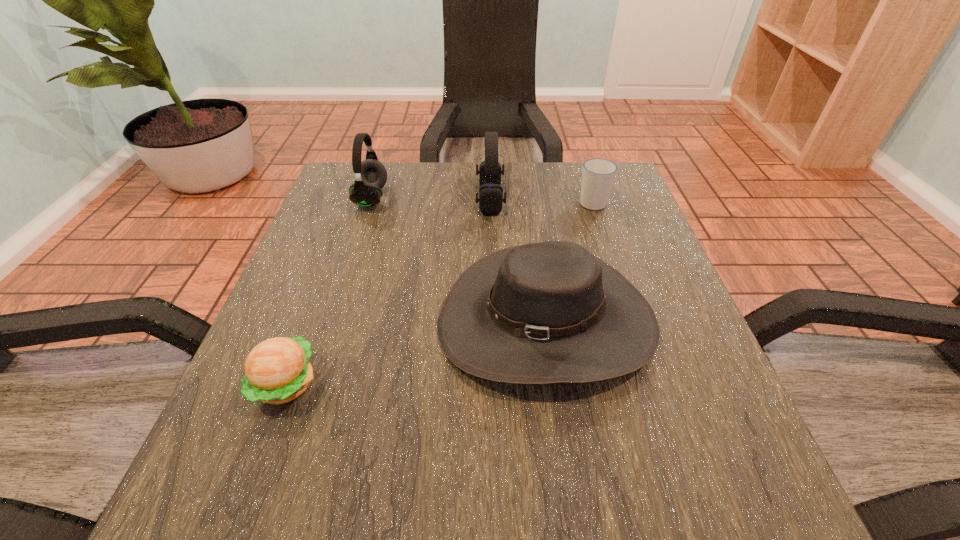
What are the coordinates of `free space located 0.080m with a handle on the side of the cup` in the screenshot? It's located at (584, 176).

Where is `vacant area located 0.150m with a handle on the side of the cup`? vacant area located 0.150m with a handle on the side of the cup is located at coordinates (579, 162).

The height and width of the screenshot is (540, 960). In order to click on blank space located on the front of the hamburger in this screenshot , I will do `click(252, 474)`.

The height and width of the screenshot is (540, 960). I want to click on cup positioned at the far edge, so click(x=598, y=175).

I want to click on headset at the left edge, so click(x=371, y=175).

Find the location of a particular element. The height and width of the screenshot is (540, 960). hamburger located in the left edge section of the desktop is located at coordinates (277, 370).

This screenshot has height=540, width=960. Find the location of `cowboy hat positioned at the right edge`. cowboy hat positioned at the right edge is located at coordinates (551, 312).

I want to click on cup at the right edge, so click(x=598, y=175).

Locate an element on the screen. Image resolution: width=960 pixels, height=540 pixels. object situated at the far left corner is located at coordinates (371, 175).

The width and height of the screenshot is (960, 540). I want to click on object at the far right corner, so click(x=598, y=175).